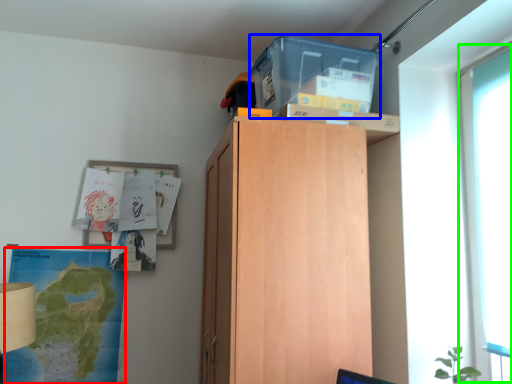
Question: Estimate the real-world distances between objects in this image. Which object is closer to map (highlighted by a red box), storage box (highlighted by a blue box) or glass door (highlighted by a green box)?

Choices:
 (A) storage box
 (B) glass door

Answer: (A)